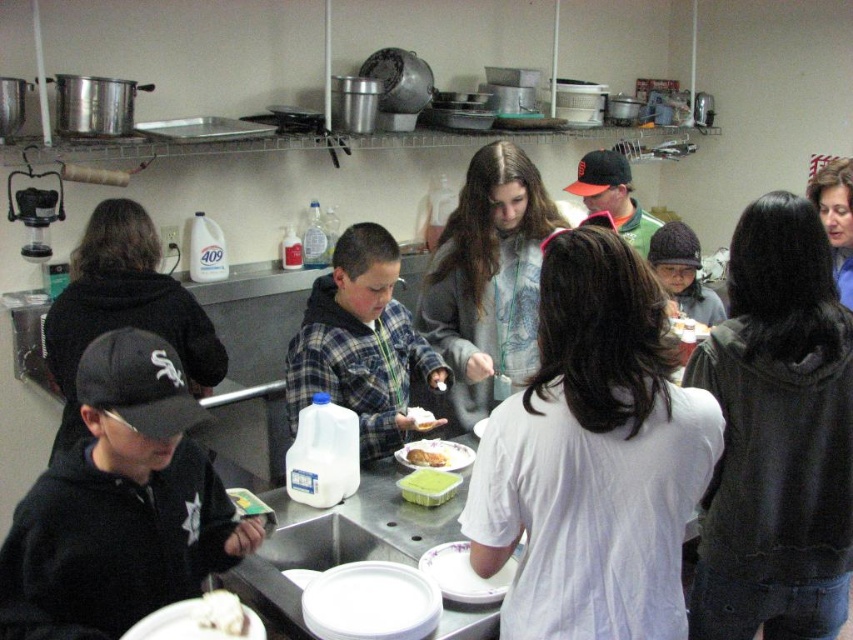
Is point (230, 627) in front of point (408, 451)?

Yes.

This screenshot has width=853, height=640. Find the location of `white creamy cake at center`. white creamy cake at center is located at coordinates (221, 614).

Identify the location of white creamy cake at center. The height and width of the screenshot is (640, 853). (221, 614).

Who is positioned more to the left, white creamy cake at center or yellowish matte plate at center?

white creamy cake at center is more to the left.

Is white creamy cake at center thinner than yellowish matte plate at center?

Yes.

Where is `white creamy cake at center`? This screenshot has height=640, width=853. white creamy cake at center is located at coordinates (221, 614).

I want to click on white creamy cake at center, so click(x=221, y=614).

Can you confirm if green plastic container at center is wider than white matte bread at center?

Indeed, green plastic container at center has a greater width compared to white matte bread at center.

Which is behind, point (421, 488) or point (421, 413)?

Positioned behind is point (421, 413).

You are a GUI agent. You are given a task and a screenshot of the screen. Output one action in this format:
    pyautogui.click(x=<x>, y=<y>)
    Task: Click on the green plastic container at center
    
    Given the screenshot: What is the action you would take?
    pyautogui.click(x=428, y=486)